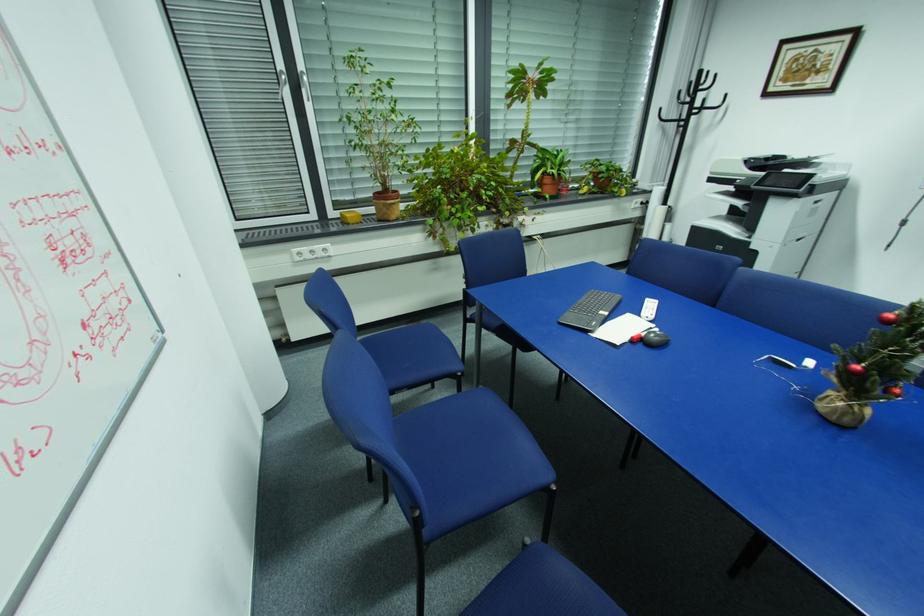
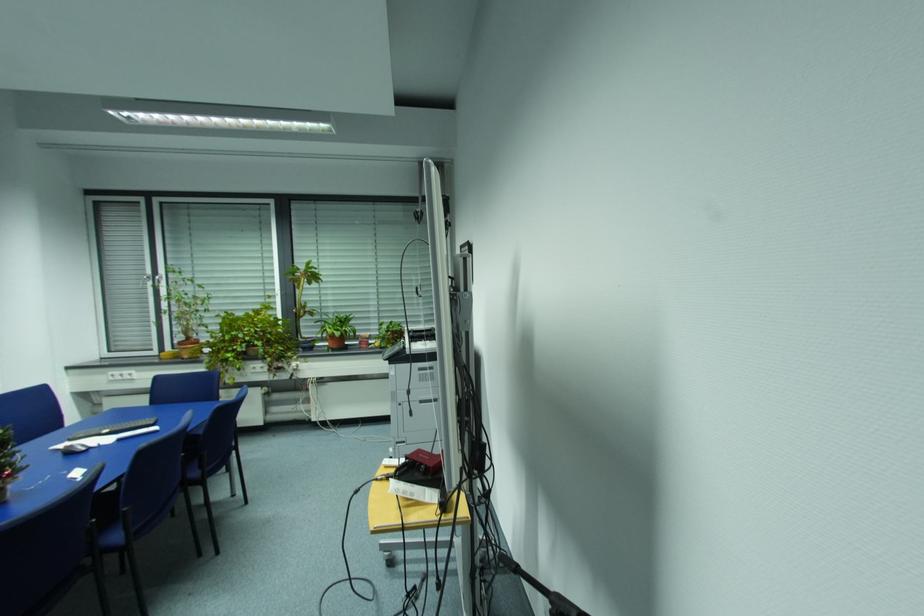
Question: In a continuous first-person perspective shot, in which direction is the camera moving?

Choices:
 (A) Left
 (B) Right
 (C) Forward
 (D) Backward

Answer: (B)